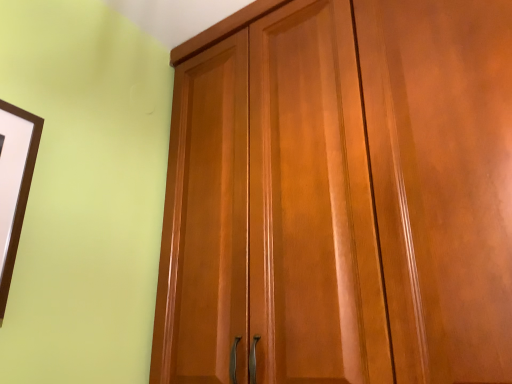
Find the location of a particular element. The width and height of the screenshot is (512, 384). glossy wood cupboard at upper right is located at coordinates (340, 196).

The image size is (512, 384). Describe the element at coordinates (340, 196) in the screenshot. I see `glossy wood cupboard at upper right` at that location.

At what (x,y) coordinates should I click in order to perform the action: click on glossy wood cupboard at upper right. Please return your answer as a coordinate pair (x, y). Image resolution: width=512 pixels, height=384 pixels. Looking at the image, I should click on (340, 196).